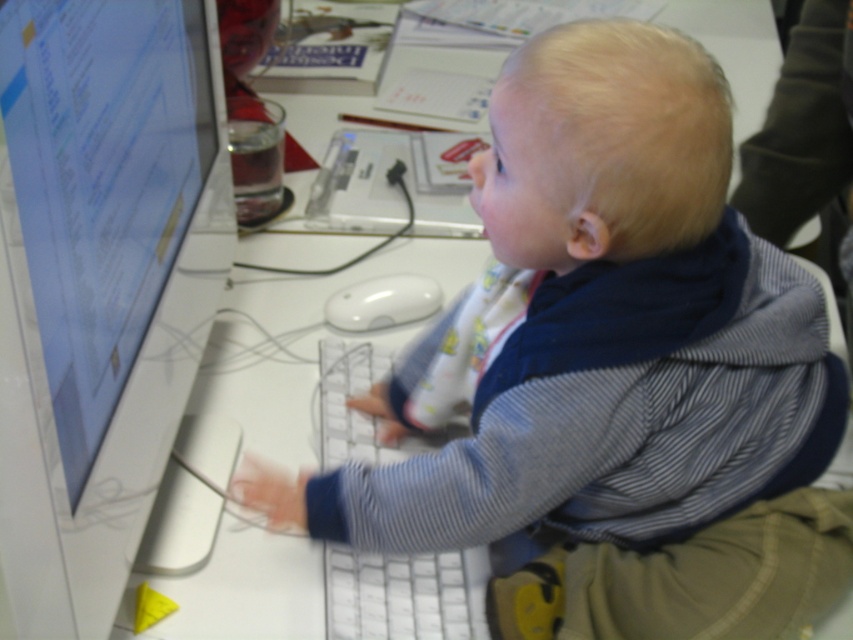
In the scene shown: You are a delivery robot trying to place a small package on the desk. The package requires a clear space of at least 12 inches from the edge of the desk to avoid falling off. Given the coordinates of the point on the desk at point (99, 358), can you determine if placing the package there would be safe?

The distance between point (99, 358) and the camera is 26.17 inches. However, this measurement does not directly indicate the distance from the edge of the desk. Therefore, it is unclear if placing the package at point (99, 358) would be safe based on the provided information.

The child is sitting at the desk. Where is the striped cotton shirt at center located in relation to the point marked at coordinates [625,368]?

The point marked at coordinates [625,368] corresponds to the striped cotton shirt at center, so they are in the same location.

You are a student who just entered the classroom and need to sit at the desk. Where should you place your backpack so it doesn not block the white glossy monitor at left?

You should place your backpack away from the area at point (100, 284) where the white glossy monitor at left is located to avoid blocking it.